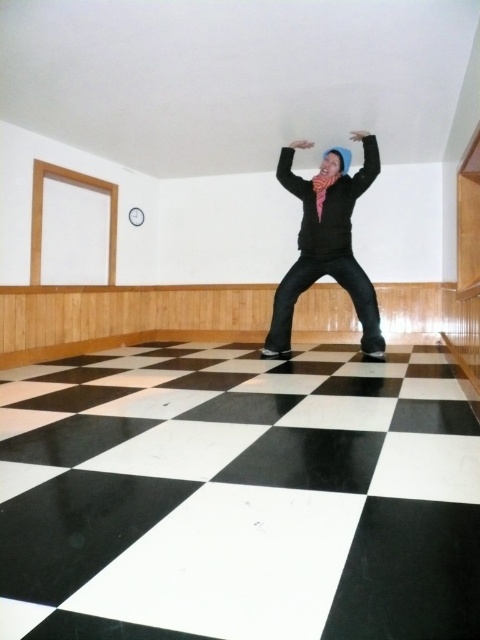
Who is shorter, matte black hoodie at center or matte black arm at upper center?

Standing shorter between the two is matte black arm at upper center.

Is point (342, 180) in front of point (286, 164)?

Yes, point (342, 180) is in front of point (286, 164).

In order to click on matte black hoodie at center in this screenshot , I will do `click(326, 241)`.

Locate an element on the screen. The image size is (480, 640). matte black hoodie at center is located at coordinates (326, 241).

What do you see at coordinates (326, 241) in the screenshot?
I see `matte black hoodie at center` at bounding box center [326, 241].

Locate an element on the screen. The width and height of the screenshot is (480, 640). matte black hoodie at center is located at coordinates (326, 241).

Is black matte arm at upper center below matte black arm at upper center?

Actually, black matte arm at upper center is above matte black arm at upper center.

Measure the distance between point (361, 189) and camera.

4.48 meters

In order to click on black matte arm at upper center in this screenshot , I will do `click(364, 163)`.